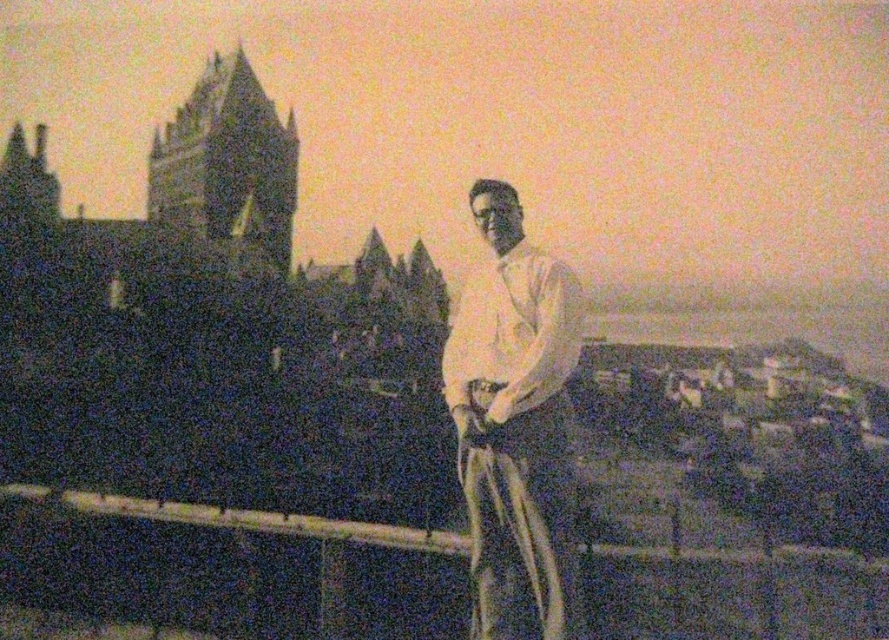
Between point (373, 589) and point (530, 282), which one is positioned behind?

The point (373, 589) is behind.

Who is positioned more to the right, wooden rail at center or white cotton shirt at center?

white cotton shirt at center

The width and height of the screenshot is (889, 640). I want to click on wooden rail at center, so click(228, 568).

I want to click on wooden rail at center, so click(x=228, y=568).